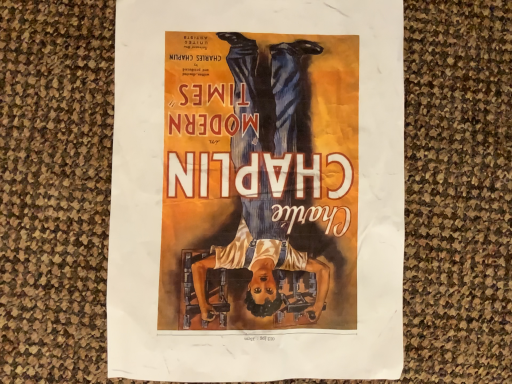
The width and height of the screenshot is (512, 384). I want to click on free point above matte paper poster at center (from a real-world perspective), so click(x=245, y=161).